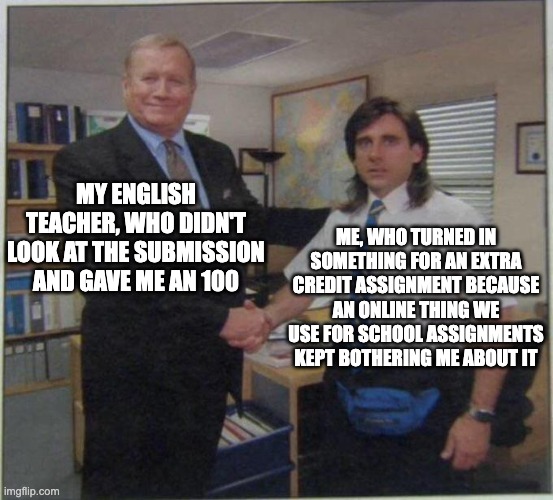
Find the location of a particular element. Image resolution: width=553 pixels, height=500 pixels. ceiling is located at coordinates (133, 25).